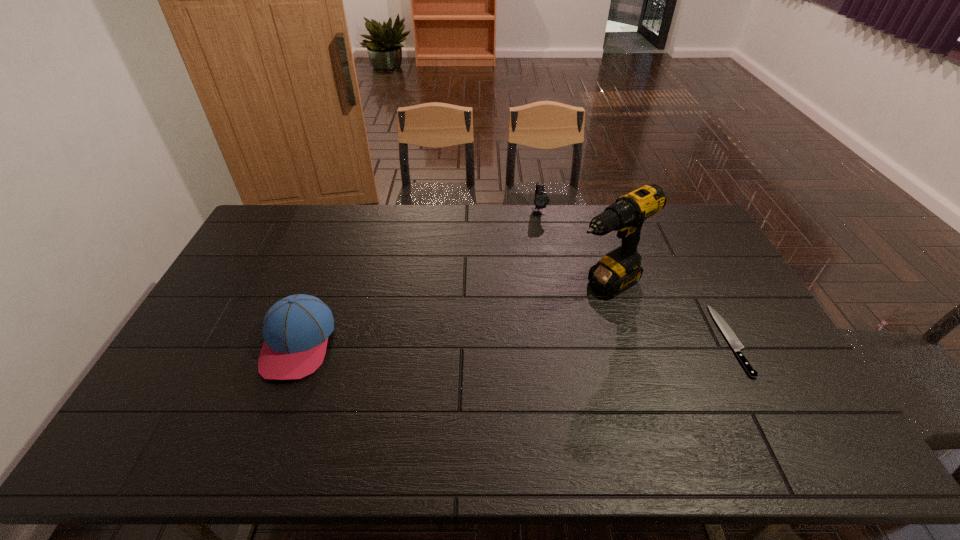
This screenshot has height=540, width=960. Find the location of `free space at the right edge of the desktop`. free space at the right edge of the desktop is located at coordinates (755, 317).

Locate an element on the screen. Image resolution: width=960 pixels, height=540 pixels. free spot at the far left corner of the desktop is located at coordinates (267, 242).

Identify the location of vacant position at the near left corner of the desktop. (164, 391).

Find the location of a particular element. The image size is (960, 540). vacant region at the near right corner of the desktop is located at coordinates (806, 406).

The width and height of the screenshot is (960, 540). What are the coordinates of `unoccupied area between the tallest object and the baseball cap` in the screenshot? It's located at (452, 314).

At what (x,y) coordinates should I click in order to perform the action: click on free space that is in between the second object from left to right and the third object from left to right. Please return your answer as a coordinate pair (x, y). Image resolution: width=960 pixels, height=540 pixels. Looking at the image, I should click on (572, 248).

At what (x,y) coordinates should I click in order to perform the action: click on vacant area between the tallest object and the farthest object. Please return your answer as a coordinate pair (x, y). This screenshot has height=540, width=960. Looking at the image, I should click on (572, 248).

The width and height of the screenshot is (960, 540). I want to click on vacant area that lies between the watch and the baseball cap, so click(419, 278).

You are a GUI agent. You are given a task and a screenshot of the screen. Output one action in this format:
    pyautogui.click(x=<x>, y=<y>)
    Task: Click on the unoccupied area between the farthest object and the third object from left to right
    
    Given the screenshot: What is the action you would take?
    pyautogui.click(x=572, y=248)

Find the location of a particular element. The height and width of the screenshot is (540, 960). free space between the shortest object and the baseball cap is located at coordinates (515, 341).